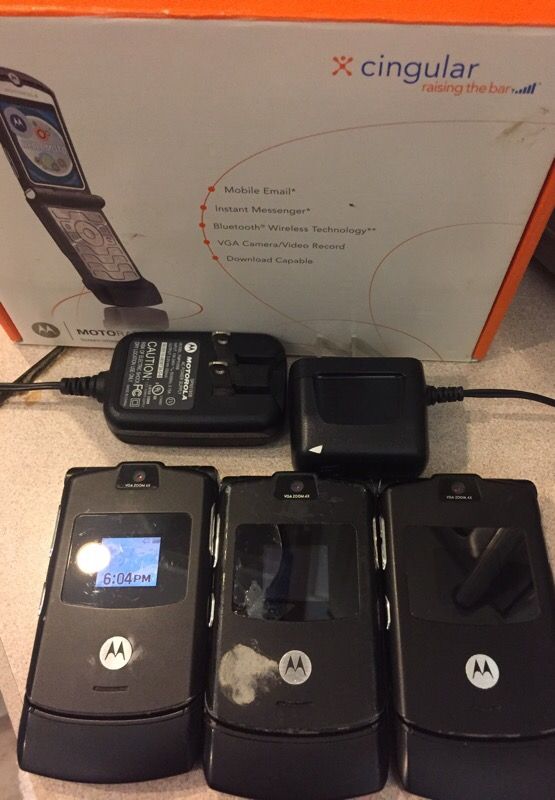
Locate an element on the screen. Image resolution: width=555 pixels, height=800 pixels. screen is located at coordinates (462, 564), (275, 564), (157, 554), (33, 142).